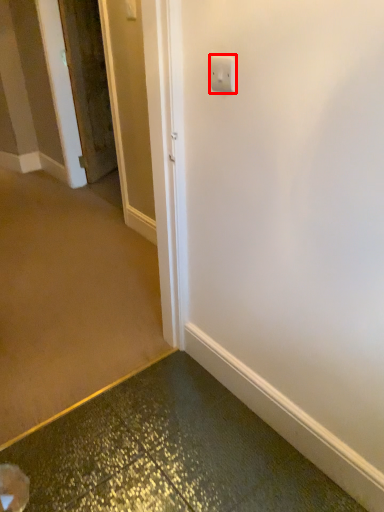
Question: From the image's perspective, where is light switch (annotated by the red box) located relative to door?

Choices:
 (A) below
 (B) above

Answer: (A)